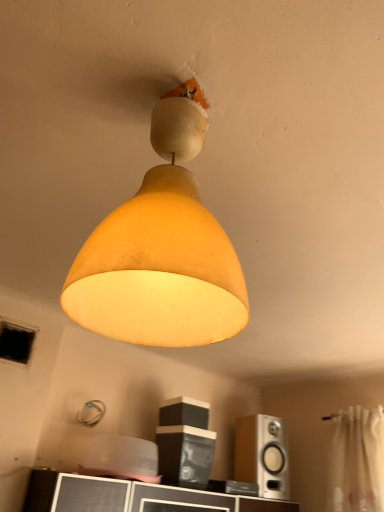
Question: Visually, is white sheer curtain at right positioned to the left or to the right of matte yellow lampshade at center?

Choices:
 (A) right
 (B) left

Answer: (A)

Question: In terms of width, does white sheer curtain at right look wider or thinner when compared to matte yellow lampshade at center?

Choices:
 (A) wide
 (B) thin

Answer: (B)

Question: Considering the real-world distances, which object is closest to the matte black speaker at center, the 1th speaker when ordered from left to right?

Choices:
 (A) silver metallic speaker at lower right, which is the second speaker in left-to-right order
 (B) white sheer curtain at right
 (C) matte yellow lampshade at center

Answer: (A)

Question: Which is nearer to the white sheer curtain at right?

Choices:
 (A) matte black speaker at center, positioned as the 2th speaker in right-to-left order
 (B) matte yellow lampshade at center
 (C) silver metallic speaker at lower right, which appears as the 1th speaker when ordered from the bottom

Answer: (C)